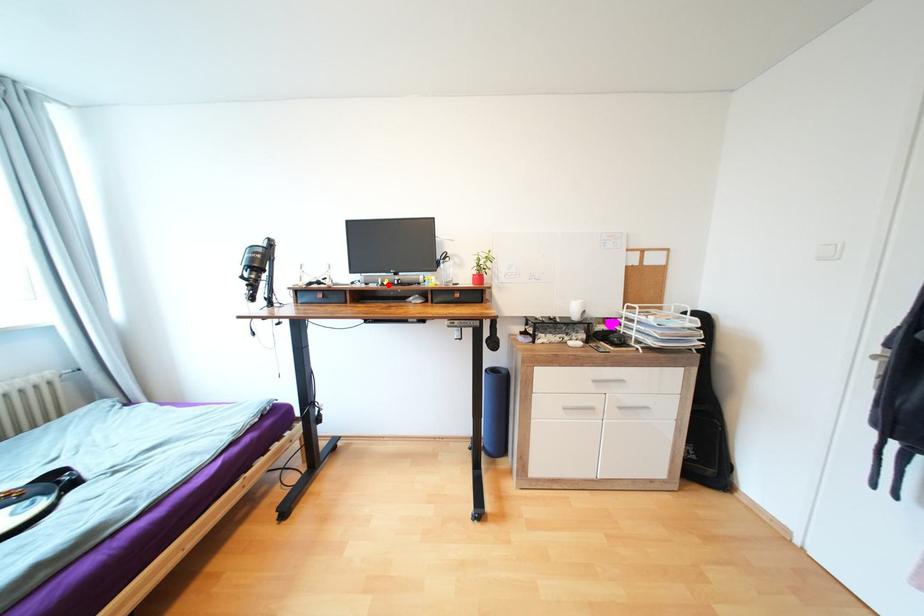
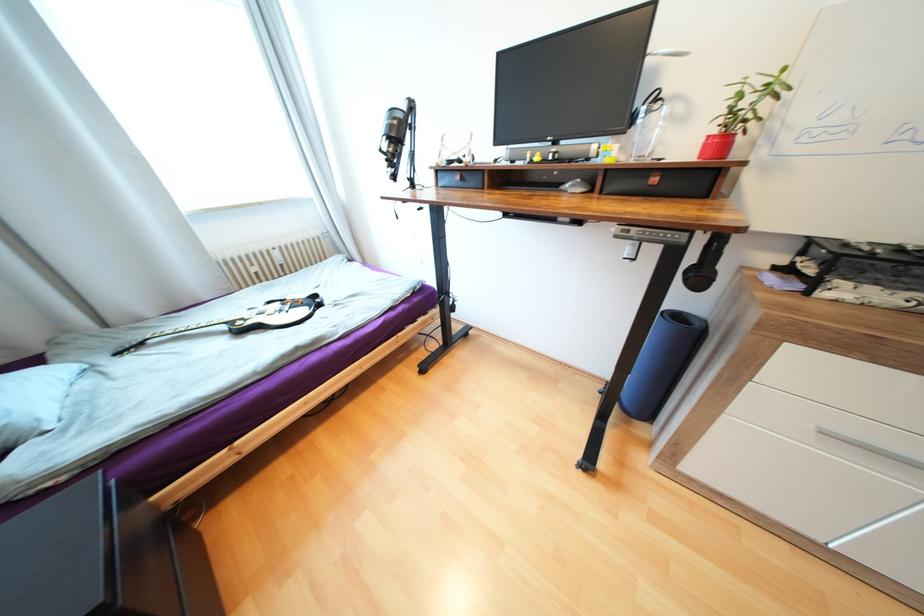
The point at the highlighted location is marked in the first image. Where is the corresponding point in the second image?

(537, 161)